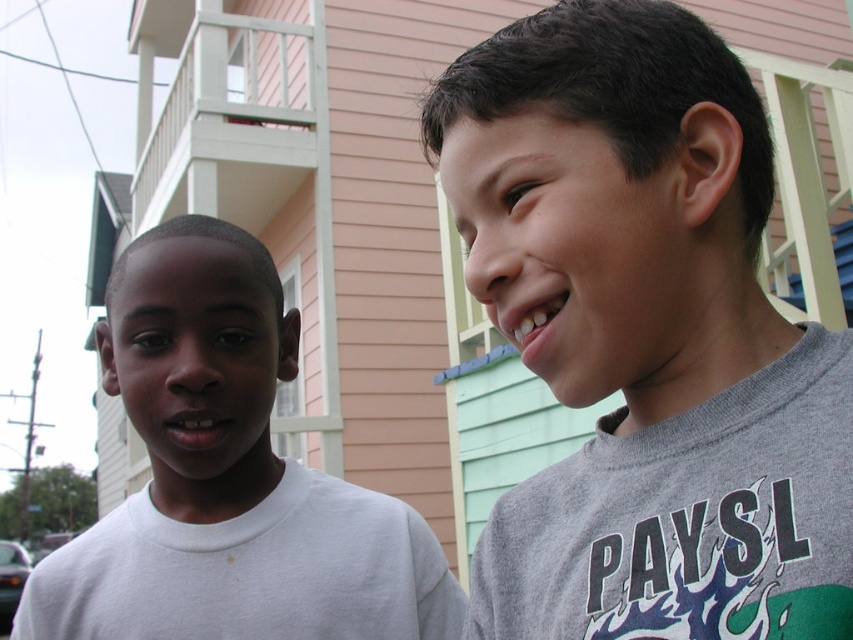
Who is positioned more to the left, gray cotton t-shirt at right or white matte shirt at left?

Positioned to the left is white matte shirt at left.

Based on the photo, does gray cotton t-shirt at right appear on the right side of white matte shirt at left?

Indeed, gray cotton t-shirt at right is positioned on the right side of white matte shirt at left.

Consider the image. Who is more distant from viewer, (604, 58) or (223, 509)?

Point (223, 509)

This screenshot has width=853, height=640. Find the location of `gray cotton t-shirt at right`. gray cotton t-shirt at right is located at coordinates (645, 337).